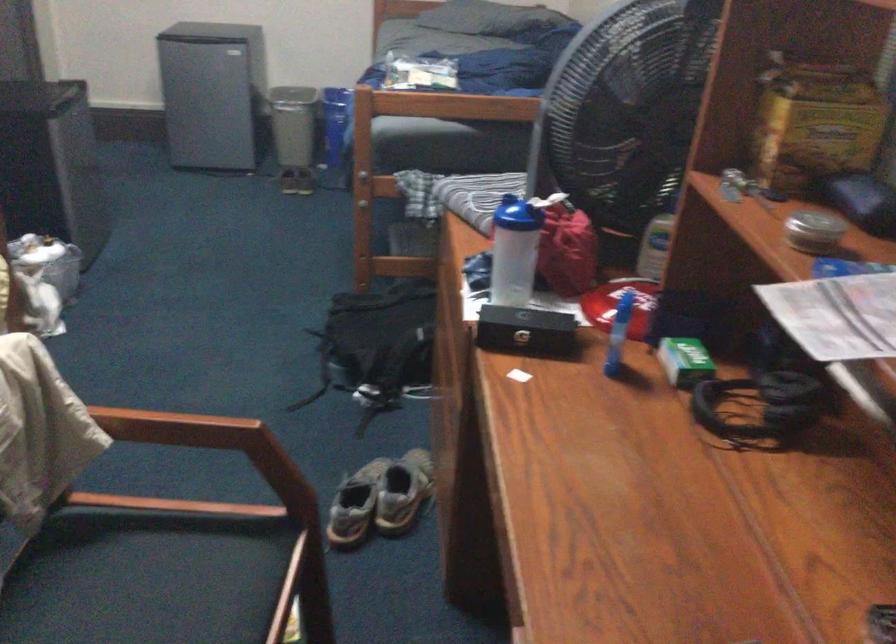
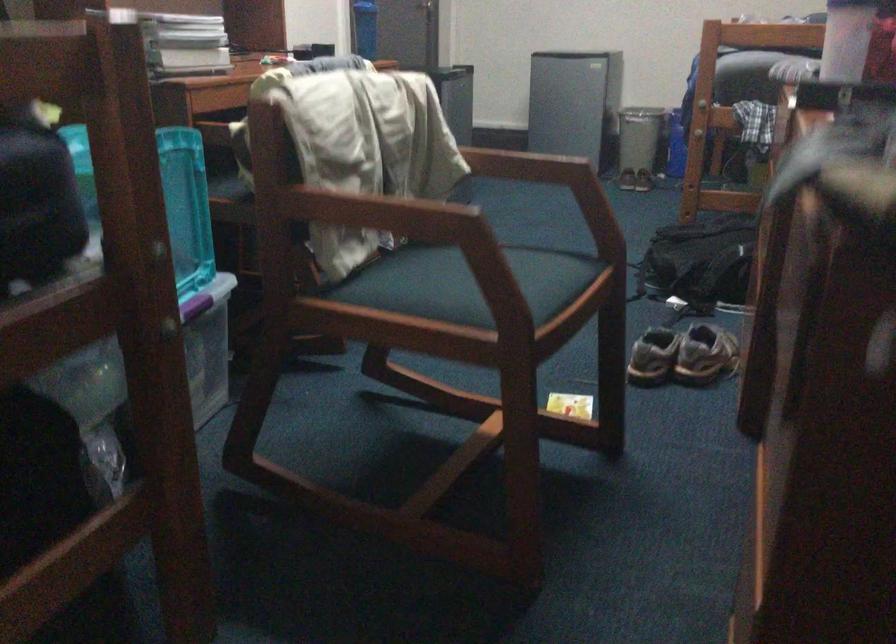
Question: I am providing you with two images of the same scene from different viewpoints. Which of the following objects are not visible in image2?

Choices:
 (A) blue water bottle
 (B) wooden chair armrest
 (C) chair sitting surface
 (D) mic arm knob

Answer: (C)